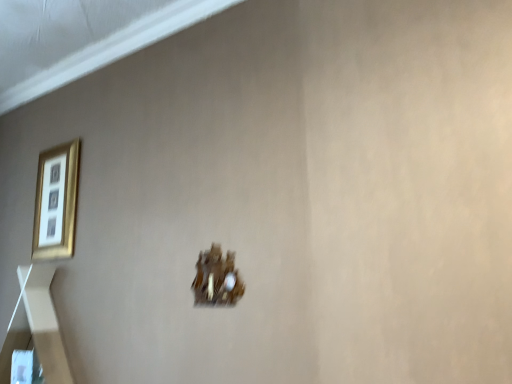
This screenshot has width=512, height=384. In order to click on gold metallic picture frame at upper left in this screenshot , I will do `click(56, 202)`.

This screenshot has height=384, width=512. Describe the element at coordinates (56, 202) in the screenshot. I see `gold metallic picture frame at upper left` at that location.

The width and height of the screenshot is (512, 384). What are the coordinates of `gold metallic picture frame at upper left` in the screenshot? It's located at (56, 202).